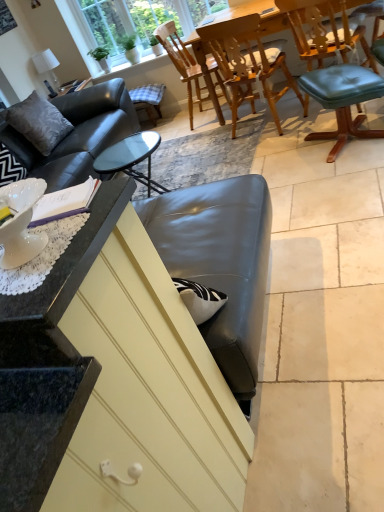
Question: Considering the positions of gray suede pillow at upper left and black granite countertop at left in the image, is gray suede pillow at upper left taller or shorter than black granite countertop at left?

Choices:
 (A) tall
 (B) short

Answer: (A)

Question: Is gray suede pillow at upper left wider or thinner than black granite countertop at left?

Choices:
 (A) thin
 (B) wide

Answer: (A)

Question: Which of these objects is positioned farthest from the wooden chair at center, placed as the second chair when sorted from right to left?

Choices:
 (A) teal leather bar stool at right, the first bar stool positioned from the bottom
 (B) clear glass window at upper center
 (C) teal leather chair at right, placed as the third chair when sorted from left to right
 (D) plaid fabric bar stool at center, the 2th bar stool from the bottom
 (E) teak wood dining table at center

Answer: (D)

Question: Based on their relative distances, which object is farther from the wooden chair at center, placed as the second chair when sorted from right to left?

Choices:
 (A) teal leather bar stool at right, placed as the 2th bar stool when sorted from top to bottom
 (B) clear glass window at upper center
 (C) teak wood dining table at center
 (D) gray suede pillow at upper left
 (E) plaid fabric bar stool at center, positioned as the second bar stool in right-to-left order

Answer: (D)